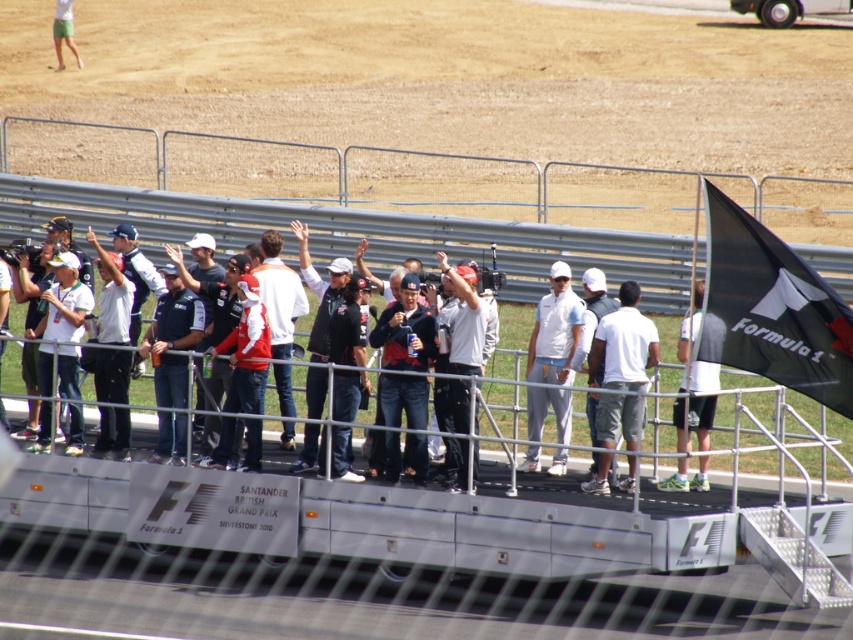
You are a photographer standing at the edge of the platform where the crowd is gathered. You want to take a photo that includes both the point at coordinates point (755, 264) and point (598, 458). Which point should you focus on first to ensure both are in sharp focus?

You should focus on point (755, 264) first because it is closer to the camera than point (598, 458). By focusing on the closer point, the farther point will also be within the depth of field, ensuring both are in sharp focus.

You are standing at the edge of the platform looking towards the center. There is a point marked at coordinates [624,344]. What object is located at that point?

The white cotton shirt at center is located at point [624,344].